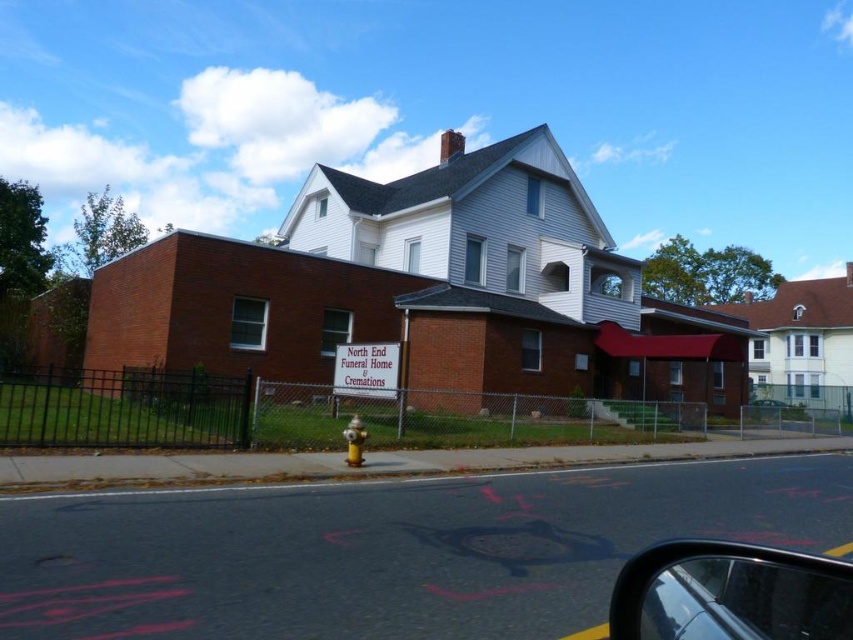
Question: Which object appears closest to the camera in this image?

Choices:
 (A) metallic silver car at center
 (B) black rubber side mirror at lower right

Answer: (B)

Question: Which of the following is the closest to the observer?

Choices:
 (A) yellow metallic hydrant at lower center
 (B) black rubber side mirror at lower right
 (C) metallic silver car at center

Answer: (B)

Question: From the image, what is the correct spatial relationship of black rubber side mirror at lower right in relation to yellow metallic hydrant at lower center?

Choices:
 (A) left
 (B) right

Answer: (B)

Question: Does black rubber side mirror at lower right have a lesser width compared to white plastic sign at center?

Choices:
 (A) yes
 (B) no

Answer: (A)

Question: Estimate the real-world distances between objects in this image. Which object is farther from the black rubber side mirror at lower right?

Choices:
 (A) white plastic sign at center
 (B) yellow metallic hydrant at lower center

Answer: (A)

Question: Is white plastic sign at center to the right of yellow metallic hydrant at lower center from the viewer's perspective?

Choices:
 (A) no
 (B) yes

Answer: (A)